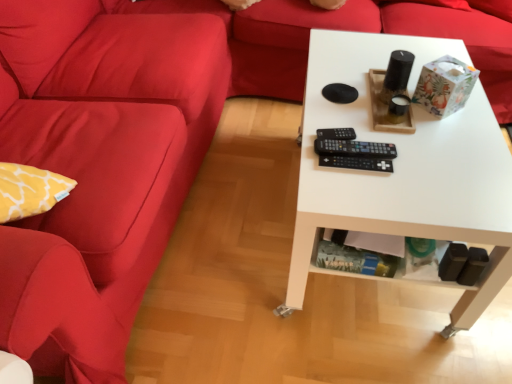
You are a GUI agent. You are given a task and a screenshot of the screen. Output one action in this format:
    pyautogui.click(x=<x>, y=<y>)
    Task: Click on the vacant position to the left of black plastic remote at center, which is counted as the third control, starting from the top
    The height and width of the screenshot is (384, 512).
    Given the screenshot: What is the action you would take?
    pyautogui.click(x=315, y=161)